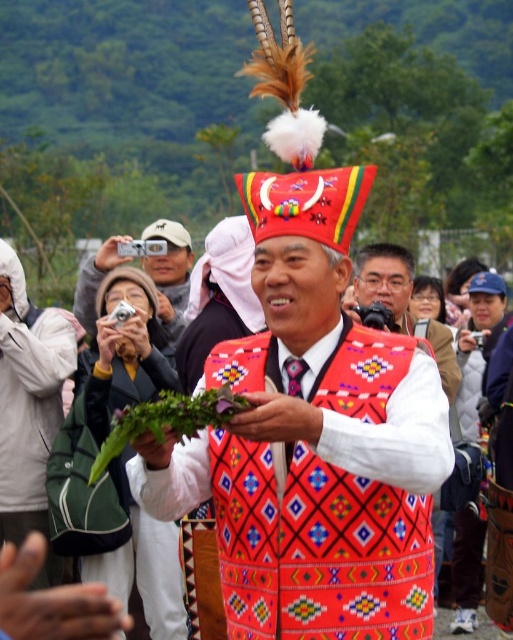
Between red fabric vest at center and matte white camera at center, which one has more height?

Standing taller between the two is red fabric vest at center.

Describe the element at coordinates (312, 438) in the screenshot. Image resolution: width=513 pixels, height=640 pixels. I see `red fabric vest at center` at that location.

This screenshot has height=640, width=513. Describe the element at coordinates (312, 438) in the screenshot. I see `red fabric vest at center` at that location.

The height and width of the screenshot is (640, 513). I want to click on red fabric vest at center, so click(x=312, y=438).